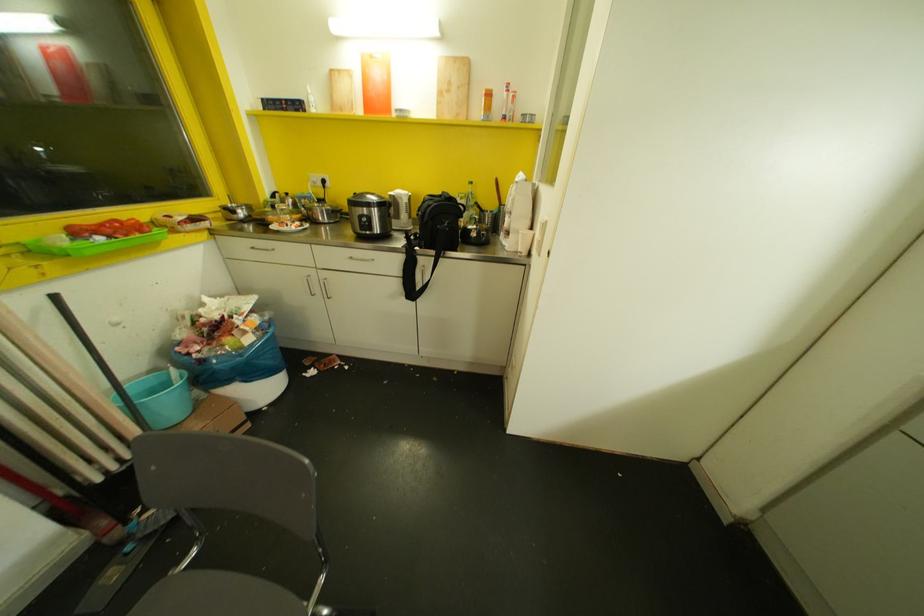
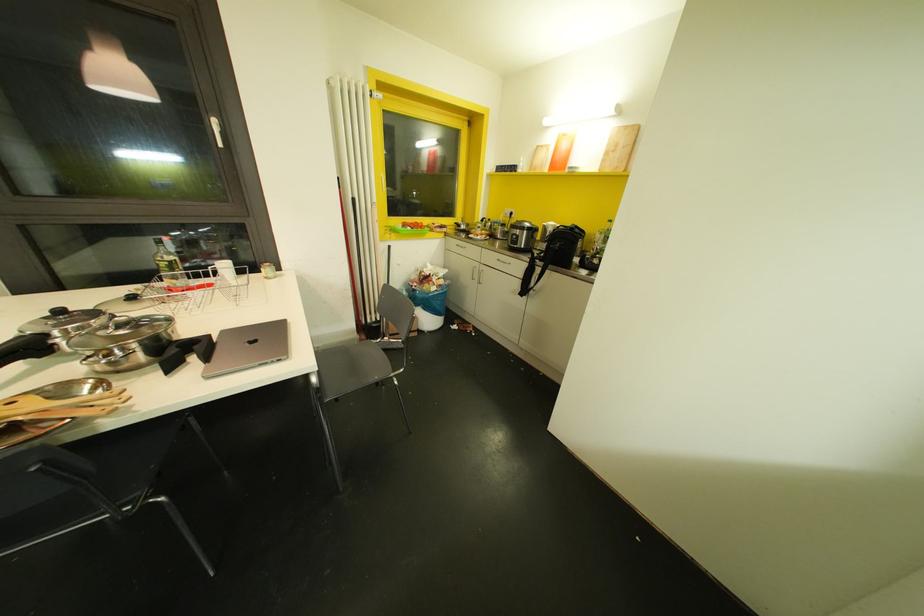
Question: The images are taken continuously from a first-person perspective. In which direction is your viewpoint rotating?

Choices:
 (A) Left
 (B) Right
 (C) Up
 (D) Down

Answer: (A)